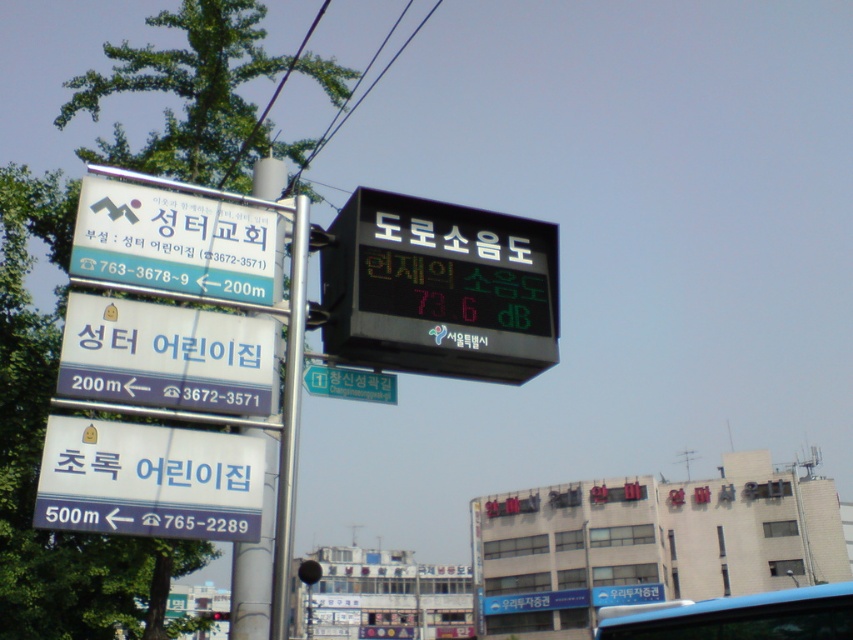
You are a tourist holding a map and looking at the street scene. You need to check both the black electronic display at upper center and the white plastic sign at upper left. Which one has a greater width?

The black electronic display at upper center has a greater width than the white plastic sign at upper left according to the description.